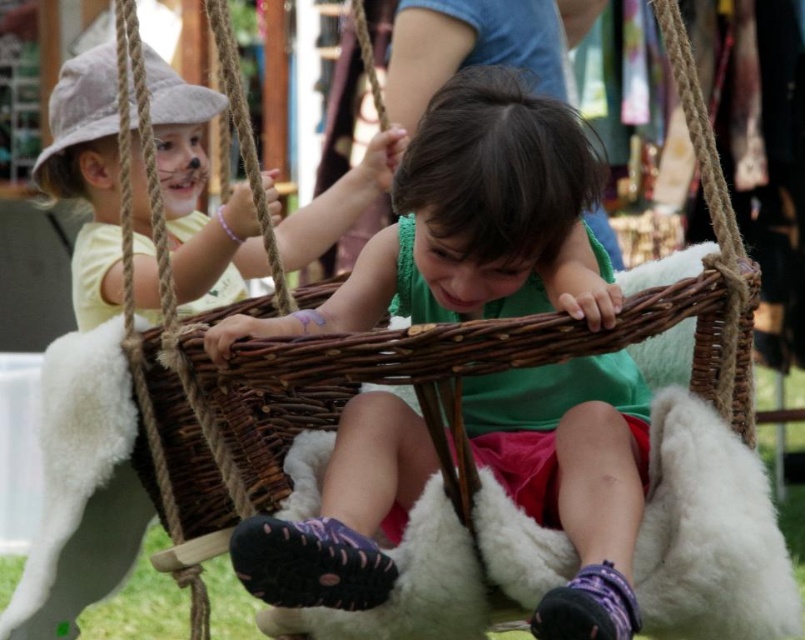
Based on the scene described, which object has a smaller width between the matte wicker basket at center and the matte yellow shirt at left?

The matte wicker basket at center has a lesser width compared to the matte yellow shirt at left.

You are a photographer trying to capture a photo of the children playing on the swing. You want to ensure that both the white fluffy cushion at center and the matte yellow shirt at left are clearly visible in the frame. Based on their positions, which object should you focus on first to ensure both are in focus?

The white fluffy cushion at center is located below the matte yellow shirt at left. To ensure both are in focus, you should focus on the matte yellow shirt at left first since it is higher up, allowing the cushion below to remain within the depth of field.